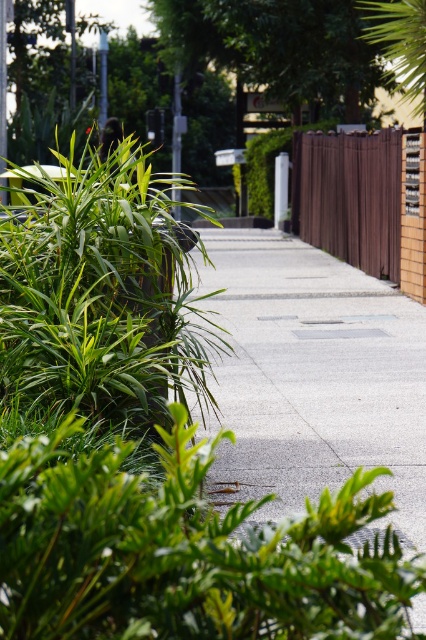
You are a gardener who needs to water both the green leafy bush at left and the green leafy tree at upper right. Based on their positions, which one should you water first if you want to start from the leftmost part of the pathway?

You should water the green leafy bush at left first because it is positioned to the left of the green leafy tree at upper right, making it the leftmost object.

You are a delivery person trying to deliver a package to a house behind the brown wooden fence at right. The concrete sidewalk at center is the only path available. Since the sidewalk is shorter than the fence, will you be able to see over the fence from the end of the sidewalk?

The concrete sidewalk at center is shorter than the brown wooden fence at right, so you will not be able to see over the fence from the end of the sidewalk because the sidewalk is shorter in length than the fence.

You are a gardener standing on the pathway and need to water both the green leafy bush at left and the green leafy tree at upper right. Your watering can holds enough water for 30 feet of travel. Can you water both without refilling?

The green leafy bush at left is 32.38 feet away from the green leafy tree at upper right. Since your watering can only allows 30 feet of travel, you cannot water both without refilling.